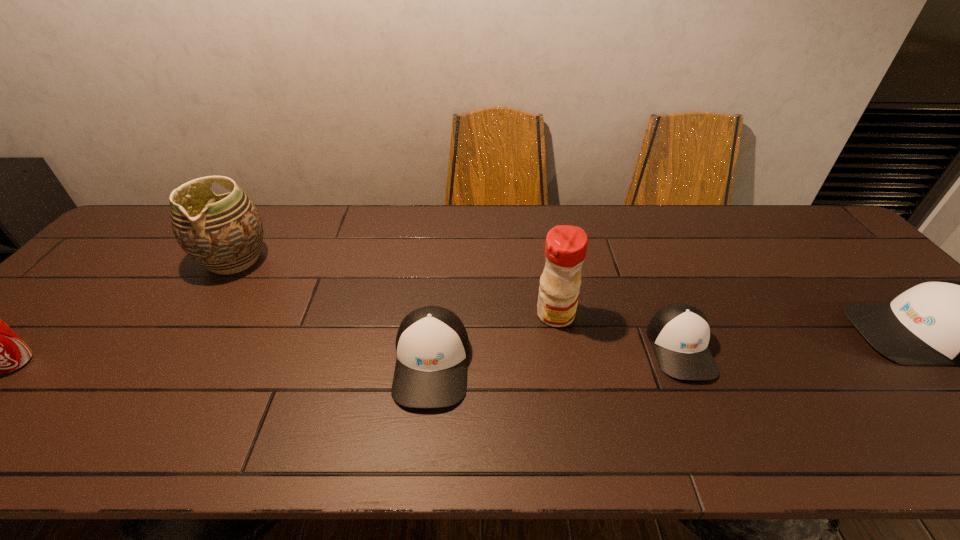
Identify which object is the third nearest to the condiment. Please provide its 2D coordinates. Your answer should be formatted as a tuple, i.e. [(x, y)], where the tuple contains the x and y coordinates of a point satisfying the conditions above.

[(944, 322)]

This screenshot has width=960, height=540. I want to click on the third closest cap to the farthest object, so (x=944, y=322).

Identify which cap is the nearest to the leftmost object. Please provide its 2D coordinates. Your answer should be formatted as a tuple, i.e. [(x, y)], where the tuple contains the x and y coordinates of a point satisfying the conditions above.

[(432, 345)]